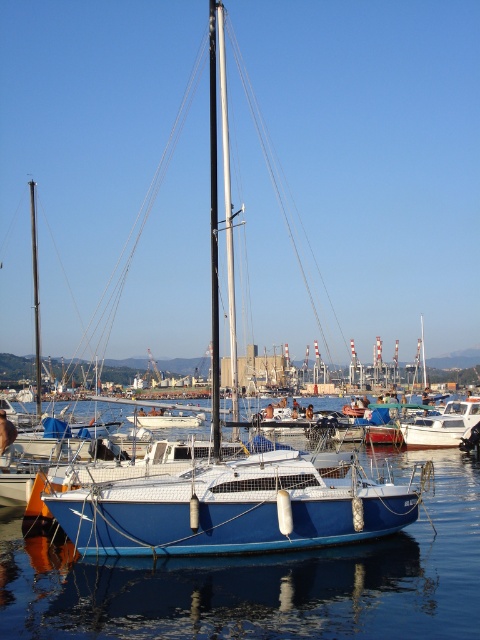
Question: Which point is closer to the camera taking this photo?

Choices:
 (A) (262, 609)
 (B) (146, 416)
 (C) (460, 403)
 (D) (33, 259)

Answer: (A)

Question: Which of the following is the farthest from the observer?

Choices:
 (A) shiny silver mast at center
 (B) blue matte sailboat at center
 (C) white glossy sailboat at center
 (D) white matte boat at center

Answer: (C)

Question: Can you confirm if blue matte sailboat at center is positioned to the right of white glossy sailboat at center?

Choices:
 (A) yes
 (B) no

Answer: (A)

Question: Can you confirm if blue matte sailboat at center is positioned above white matte boat at center?

Choices:
 (A) no
 (B) yes

Answer: (B)

Question: Which point is closer to the camera?

Choices:
 (A) (443, 444)
 (B) (140, 416)
 (C) (448, 464)
 (D) (35, 337)

Answer: (C)

Question: Does blue glossy water at center have a greater width compared to blue matte sailboat at center?

Choices:
 (A) no
 (B) yes

Answer: (B)